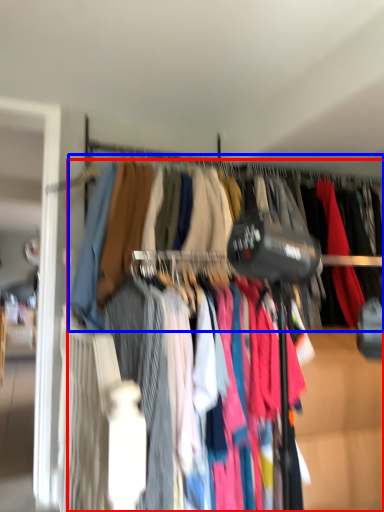
Question: Which point is further to the camera, trousers (highlighted by a red box) or closet (highlighted by a blue box)?

Choices:
 (A) trousers
 (B) closet

Answer: (B)